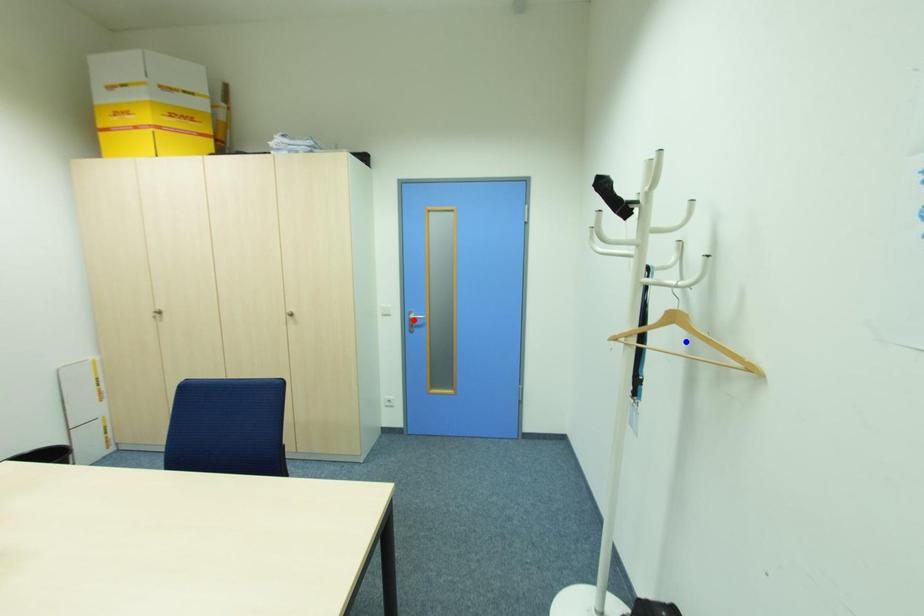
Question: In the image, two points are highlighted. Which point is nearer to the camera? Reply with the corresponding letter.

Choices:
 (A) blue point
 (B) red point

Answer: (A)